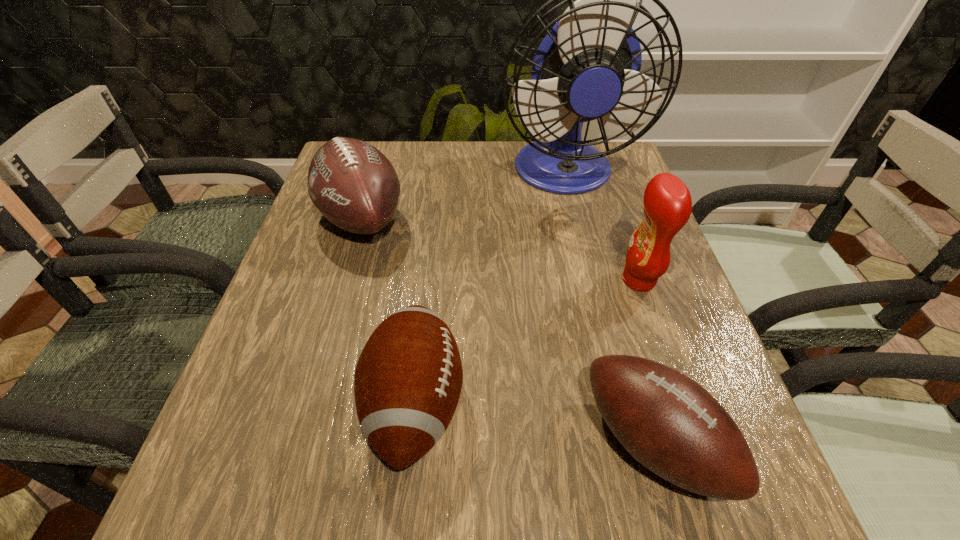
Where is `free point located 0.250m on the front of the third shortest object`? The image size is (960, 540). free point located 0.250m on the front of the third shortest object is located at coordinates (322, 357).

In order to click on free space located 0.180m on the left of the rightmost football (American) in this screenshot , I will do `click(472, 442)`.

What are the coordinates of `fan that is at the far edge` in the screenshot? It's located at (587, 67).

I want to click on football (American) that is at the far edge, so tap(354, 186).

Find the location of a particular element. object that is positioned at the left edge is located at coordinates (354, 186).

This screenshot has width=960, height=540. Identify the location of fan located in the right edge section of the desktop. (587, 67).

Identify the location of condiment positioned at the right edge. This screenshot has height=540, width=960. (667, 201).

This screenshot has height=540, width=960. I want to click on football (American) that is positioned at the right edge, so click(670, 424).

I want to click on object at the far left corner, so click(x=354, y=186).

Where is `object that is at the far right corner`? object that is at the far right corner is located at coordinates (587, 67).